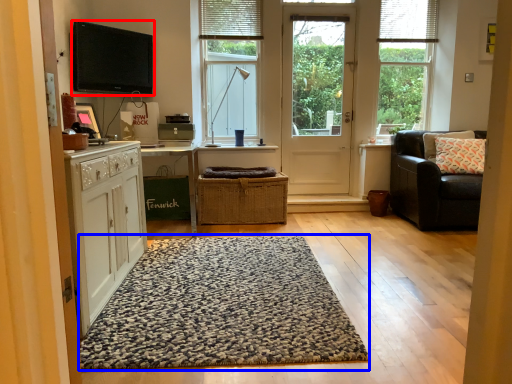
Question: Among these objects, which one is farthest to the camera, electronic (highlighted by a red box) or doormat (highlighted by a blue box)?

Choices:
 (A) electronic
 (B) doormat

Answer: (A)